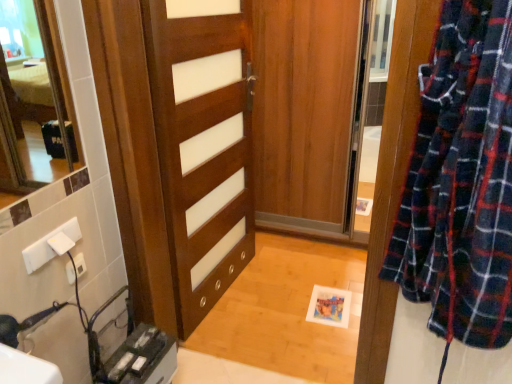
Question: Would you say wooden door at center is to the left or to the right of white plastic electric outlet at lower left in the picture?

Choices:
 (A) left
 (B) right

Answer: (B)

Question: Is point (198, 127) positioned closer to the camera than point (73, 264)?

Choices:
 (A) farther
 (B) closer

Answer: (A)

Question: In terms of size, does wooden door at center appear bigger or smaller than white plastic electric outlet at lower left?

Choices:
 (A) small
 (B) big

Answer: (B)

Question: Does point (67, 274) appear closer or farther from the camera than point (184, 6)?

Choices:
 (A) farther
 (B) closer

Answer: (B)

Question: Considering the positions of white plastic electric outlet at lower left and wooden door at center in the image, is white plastic electric outlet at lower left taller or shorter than wooden door at center?

Choices:
 (A) tall
 (B) short

Answer: (B)

Question: From the image's perspective, is white plastic electric outlet at lower left positioned above or below wooden door at center?

Choices:
 (A) below
 (B) above

Answer: (A)

Question: Relative to wooden door at center, is white plastic electric outlet at lower left in front or behind?

Choices:
 (A) behind
 (B) front

Answer: (A)